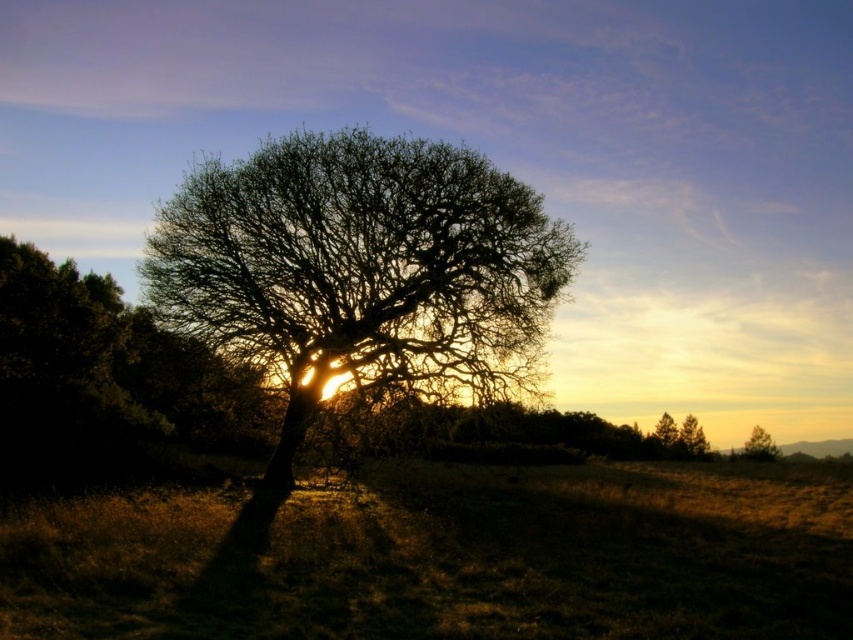
You are an artist planning to paint the scene. You want to ensure the proportions of the green matte tree at upper right and the green matte tree at lower right are accurate. Which tree should you make wider in your painting?

The green matte tree at upper right should be made wider in the painting since its width is larger than the green matte tree at lower right.

You are an artist planning to paint the scene. You need to know which of the green matte tree at upper right or the green matte tree at lower right should be depicted as smaller to maintain the perspective. Which one should be smaller?

The green matte tree at upper right should be depicted as smaller than the green matte tree at lower right to maintain perspective.